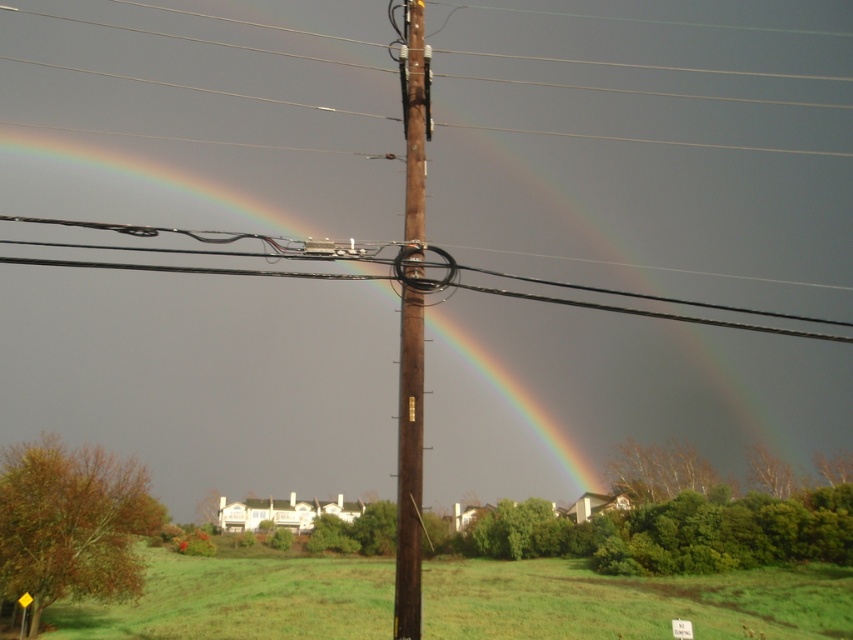
Does point (398, 502) lie behind point (427, 262)?

No, (398, 502) is closer to viewer.

Is brown wooden telegraph pole at center to the left of black wire at center from the viewer's perspective?

Correct, you'll find brown wooden telegraph pole at center to the left of black wire at center.

Does point (402, 372) come closer to viewer compared to point (572, 300)?

Yes, it is in front of point (572, 300).

Locate an element on the screen. This screenshot has width=853, height=640. brown wooden telegraph pole at center is located at coordinates (409, 458).